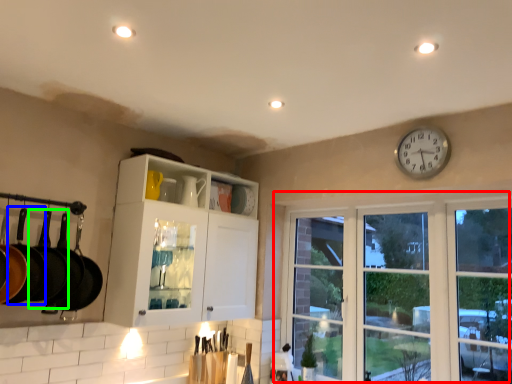
Question: Estimate the real-world distances between objects in this image. Which object is farther from window (highlighted by a red box), frying pan (highlighted by a blue box) or frying pan (highlighted by a green box)?

Choices:
 (A) frying pan
 (B) frying pan

Answer: (A)